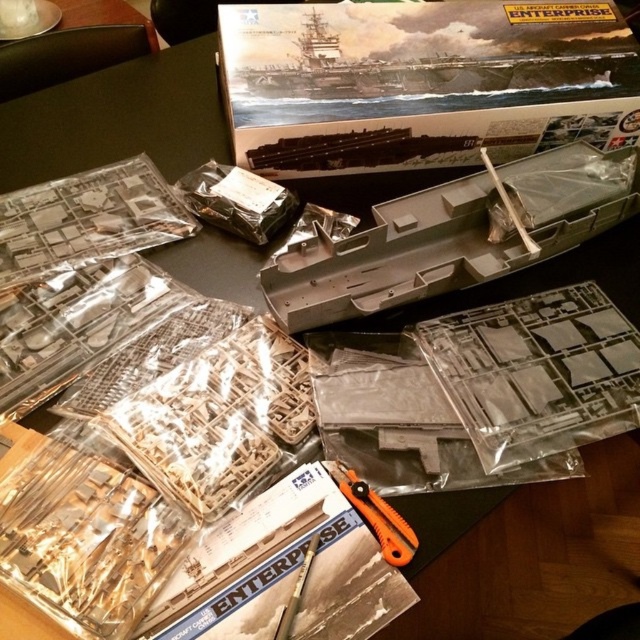
You are trying to assemble the USS Enterprise model kit and need to cut out the gray plastic boat at center using the orange plastic scissors at center. If your hand moves the scissors 10 inches forward from their current position, will they reach the boat?

The gray plastic boat at center is 15.10 inches away from the orange plastic scissors at center. Moving the scissors 10 inches forward won

You are an engineer assembling a model kit of the USS Enterprise. You have two points marked on your workspace. The first point is at coordinate point (374, 273) and the second is at coordinate point (390, 564). From your perspective standing at the edge of the table, which point is closer to you?

Point (390, 564) is closer to you because it is in front of point (374, 273).

You are a model builder who wants to assemble the gray plastic boat at center. You have the orange plastic scissors at center nearby. Can you easily reach the scissors without moving the boat?

The gray plastic boat at center is closer to you than the orange plastic scissors at center. Since the boat is in front of the scissors, you would need to move it to access the scissors.